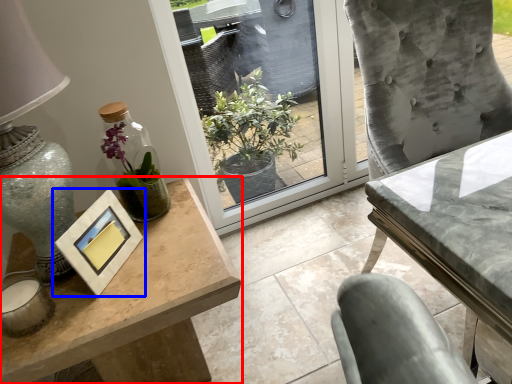
Question: Which object is further to the camera taking this photo, table (highlighted by a red box) or picture frame (highlighted by a blue box)?

Choices:
 (A) table
 (B) picture frame

Answer: (B)